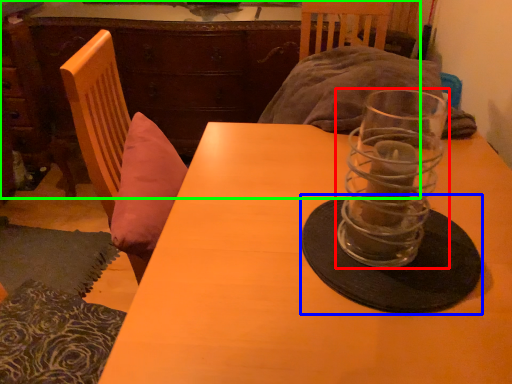
Question: Considering the real-world distances, which object is farthest from tableware (highlighted by a red box)? glass plate (highlighted by a blue box) or dresser (highlighted by a green box)?

Choices:
 (A) glass plate
 (B) dresser

Answer: (B)